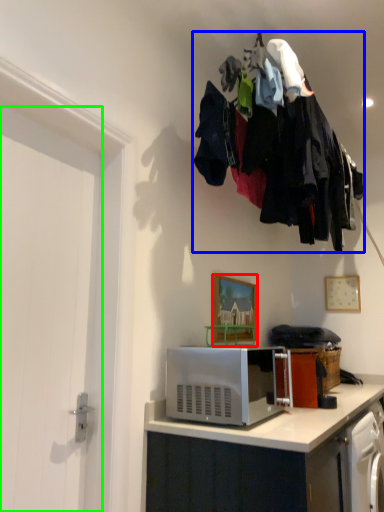
Question: Which object is positioned farthest from picture frame (highlighted by a red box)? Select from laundry (highlighted by a blue box) and door (highlighted by a green box).

Choices:
 (A) laundry
 (B) door

Answer: (B)